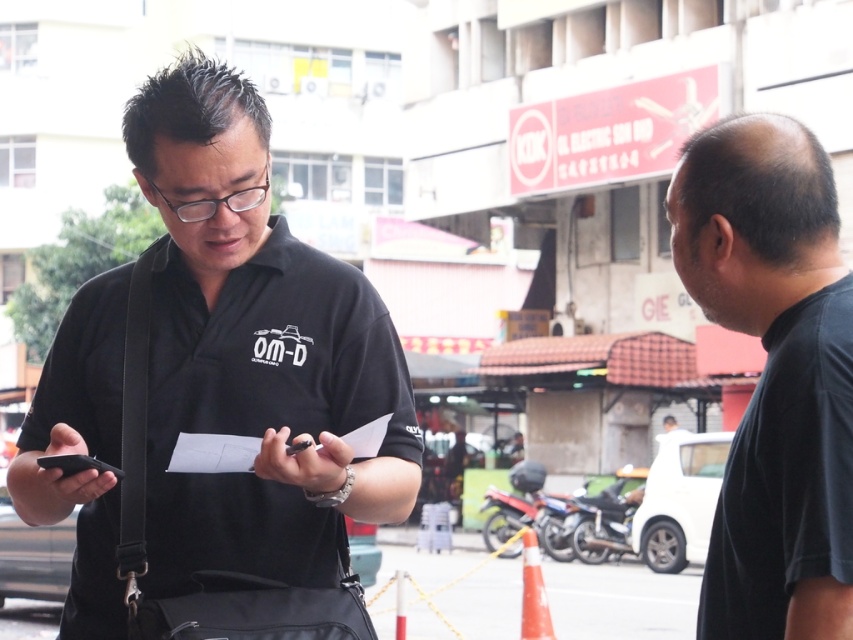
Based on the photo, you are a delivery rider who needs to place your metallic silver motorcycle at lower right and your black matte smartphone at left in your delivery bag. The bag has a maximum capacity of 25 meters in length. Can both items fit inside the bag if placed end to end?

The metallic silver motorcycle at lower right and black matte smartphone at left are 23.39 meters apart. Since the total length required is 23.39 meters and the bag can hold up to 25 meters, both items can fit inside the bag when placed end to end.

You are a delivery person needing to deliver a package to the person wearing the black matte shirt at right. The motorcycle, metallic silver motorcycle at center, is blocking your path. Can you walk around the motorcycle to reach the person?

The black matte shirt at right is to the left of the metallic silver motorcycle at center, so you can walk around the motorcycle to the left side to reach the person.

You are a delivery person who needs to reach the metallic silver motorcycle at center parked in the urban area. There is a person wearing a black matte shirt at right blocking your path. Can you safely navigate around them to reach the motorcycle without getting too close?

The distance between the black matte shirt at right and the metallic silver motorcycle at center is 25.09 meters, so you can safely navigate around the person wearing the black matte shirt at right to reach the motorcycle without getting too close.